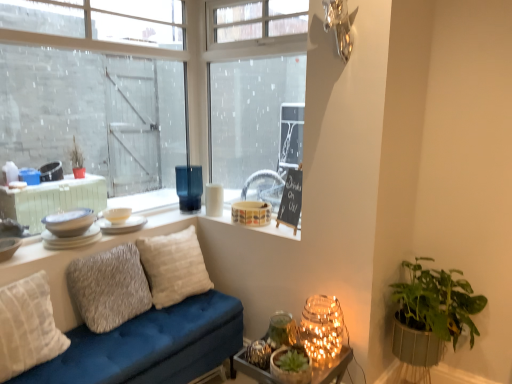
Where is `vacant point above matte white plate at upper left, which appears as the third tableware when viewed from the front (from a real-world perspective)`? vacant point above matte white plate at upper left, which appears as the third tableware when viewed from the front (from a real-world perspective) is located at coordinates (117, 210).